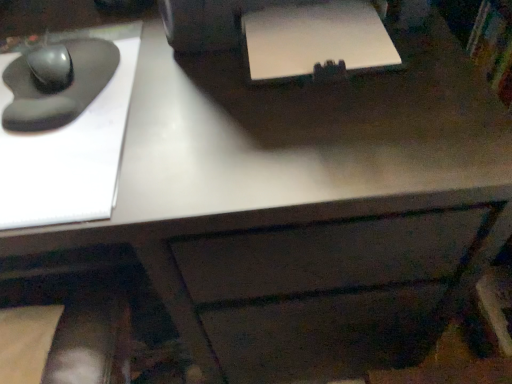
I want to click on free point above matte black mouse at left, the second mouse positioned from the top (from a real-world perspective), so click(x=74, y=77).